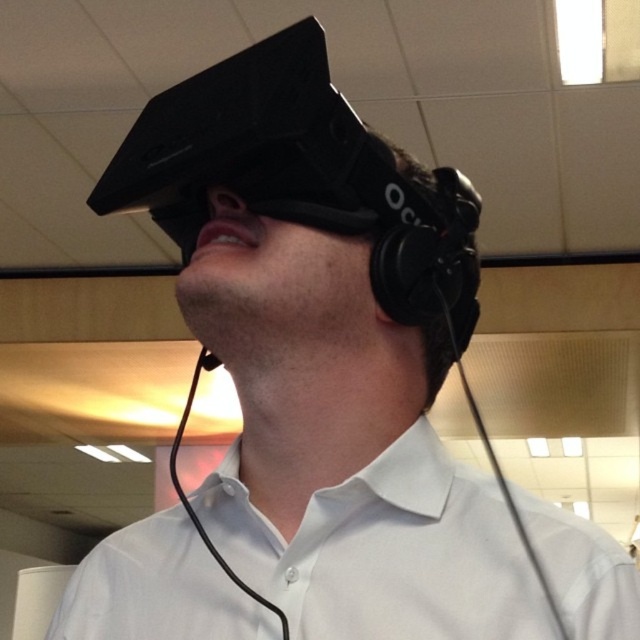
You are a fashion designer observing the VR user in the scene. You need to determine if the white cotton dress shirt at center can be seen from above the black matte earphone at upper center. Can you confirm this?

The white cotton dress shirt at center has a greater height compared to the black matte earphone at upper center, so yes, the white cotton dress shirt at center can be seen from above the black matte earphone at upper center because it is taller.

You are a fashion designer observing the VR setup. You need to determine which item has a greater width between the white cotton dress shirt at center and the black matte earphone at upper center. Which one is wider?

The white cotton dress shirt at center is wider than the black matte earphone at upper center.